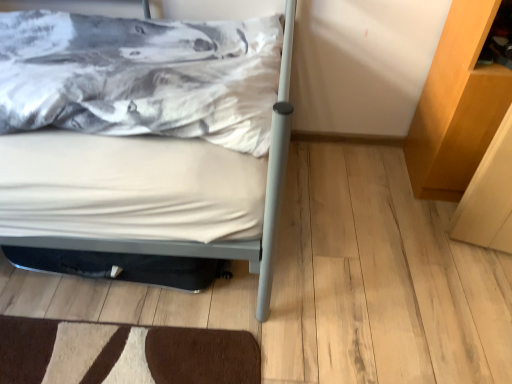
Locate an element on the screen. The image size is (512, 384). vacant space to the right of white matte bed at upper left is located at coordinates (362, 247).